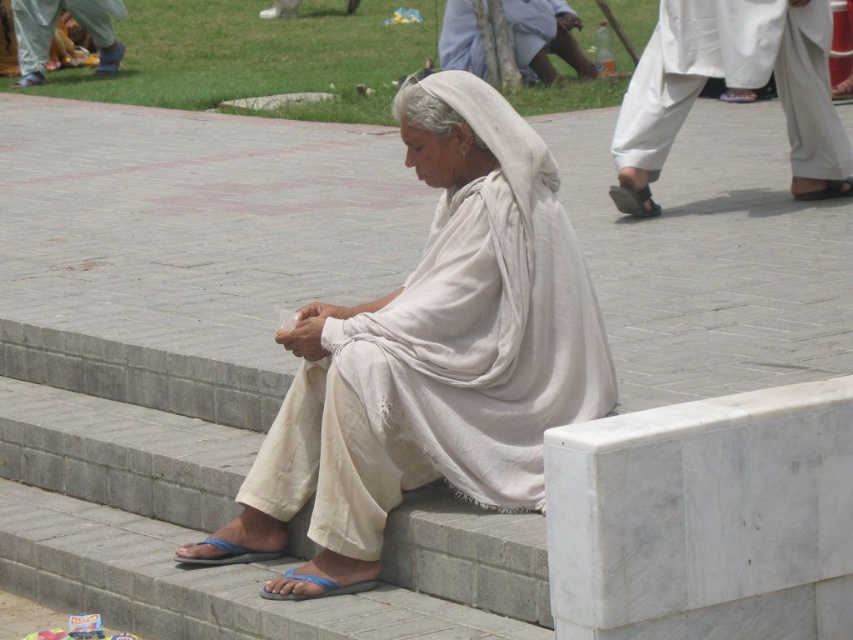
You are a photographer trying to capture the elderly woman in the scene. You notice two white cotton robes in the image. Which one is closer to the camera, the white cotton robe at right or the white cotton robe at upper center?

The white cotton robe at upper center is closer to the camera because the white cotton robe at right is positioned under it.